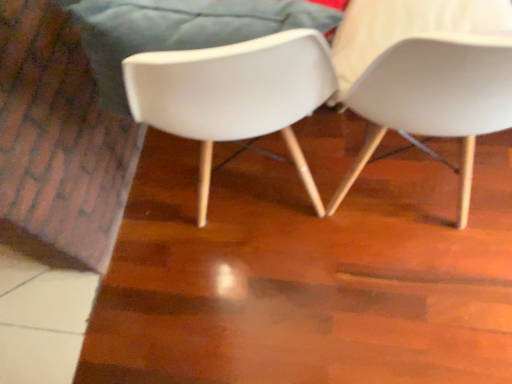
Question: Can you confirm if white matte chair at center, the second chair in the right-to-left sequence, is bigger than white plastic chair at right, arranged as the first chair when viewed from the right?

Choices:
 (A) no
 (B) yes

Answer: (A)

Question: From a real-world perspective, is white matte chair at center, the second chair in the right-to-left sequence, beneath white plastic chair at right, arranged as the first chair when viewed from the right?

Choices:
 (A) yes
 (B) no

Answer: (A)

Question: Considering the relative sizes of white matte chair at center, the second chair in the right-to-left sequence, and white plastic chair at right, which appears as the 2th chair when viewed from the left, in the image provided, is white matte chair at center, the second chair in the right-to-left sequence, wider than white plastic chair at right, which appears as the 2th chair when viewed from the left,?

Choices:
 (A) no
 (B) yes

Answer: (B)

Question: Considering the relative positions of white matte chair at center, the 1th chair from the left, and white plastic chair at right, which appears as the 2th chair when viewed from the left, in the image provided, is white matte chair at center, the 1th chair from the left, to the left of white plastic chair at right, which appears as the 2th chair when viewed from the left, from the viewer's perspective?

Choices:
 (A) no
 (B) yes

Answer: (B)

Question: Considering the relative sizes of white matte chair at center, the second chair in the right-to-left sequence, and white plastic chair at right, which appears as the 2th chair when viewed from the left, in the image provided, is white matte chair at center, the second chair in the right-to-left sequence, shorter than white plastic chair at right, which appears as the 2th chair when viewed from the left,?

Choices:
 (A) yes
 (B) no

Answer: (B)

Question: From the image's perspective, is white matte chair at center, the second chair in the right-to-left sequence, over white plastic chair at right, arranged as the first chair when viewed from the right?

Choices:
 (A) no
 (B) yes

Answer: (B)

Question: Is the depth of white plastic chair at right, arranged as the first chair when viewed from the right, less than that of white matte chair at center, the second chair in the right-to-left sequence?

Choices:
 (A) no
 (B) yes

Answer: (B)

Question: Considering the relative sizes of white plastic chair at right, arranged as the first chair when viewed from the right, and white matte chair at center, the second chair in the right-to-left sequence, in the image provided, is white plastic chair at right, arranged as the first chair when viewed from the right, wider than white matte chair at center, the second chair in the right-to-left sequence,?

Choices:
 (A) yes
 (B) no

Answer: (B)

Question: Can you confirm if white plastic chair at right, which appears as the 2th chair when viewed from the left, is thinner than white matte chair at center, the 1th chair from the left?

Choices:
 (A) yes
 (B) no

Answer: (A)

Question: Is the depth of white plastic chair at right, which appears as the 2th chair when viewed from the left, greater than that of white matte chair at center, the 1th chair from the left?

Choices:
 (A) yes
 (B) no

Answer: (B)

Question: Is white plastic chair at right, arranged as the first chair when viewed from the right, facing away from white matte chair at center, the second chair in the right-to-left sequence?

Choices:
 (A) yes
 (B) no

Answer: (B)

Question: Is white matte chair at center, the second chair in the right-to-left sequence, located within white plastic chair at right, which appears as the 2th chair when viewed from the left?

Choices:
 (A) yes
 (B) no

Answer: (B)

Question: Considering the relative positions of white matte chair at center, the 1th chair from the left, and white plastic chair at right, which appears as the 2th chair when viewed from the left, in the image provided, is white matte chair at center, the 1th chair from the left, to the left or to the right of white plastic chair at right, which appears as the 2th chair when viewed from the left,?

Choices:
 (A) left
 (B) right

Answer: (A)